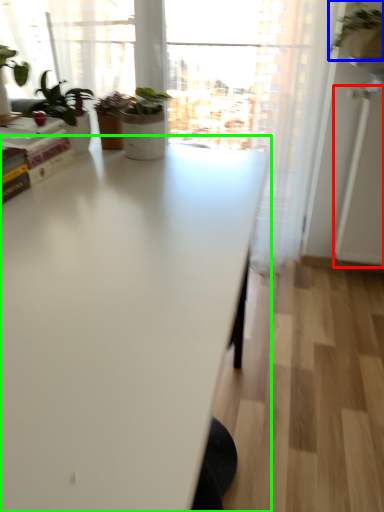
Question: Considering the real-world distances, which object is closest to screen door (highlighted by a red box)? houseplant (highlighted by a blue box) or table (highlighted by a green box).

Choices:
 (A) houseplant
 (B) table

Answer: (A)